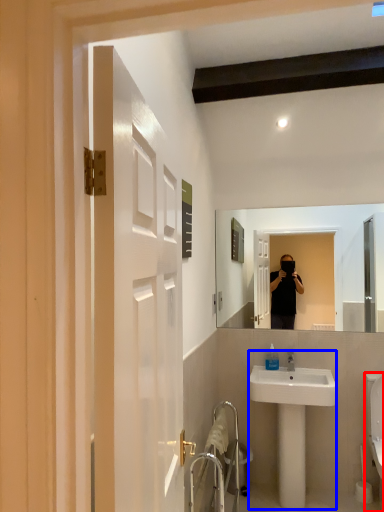
Question: Which object appears farthest to the camera in this image, toilet (highlighted by a red box) or sink (highlighted by a blue box)?

Choices:
 (A) toilet
 (B) sink

Answer: (B)